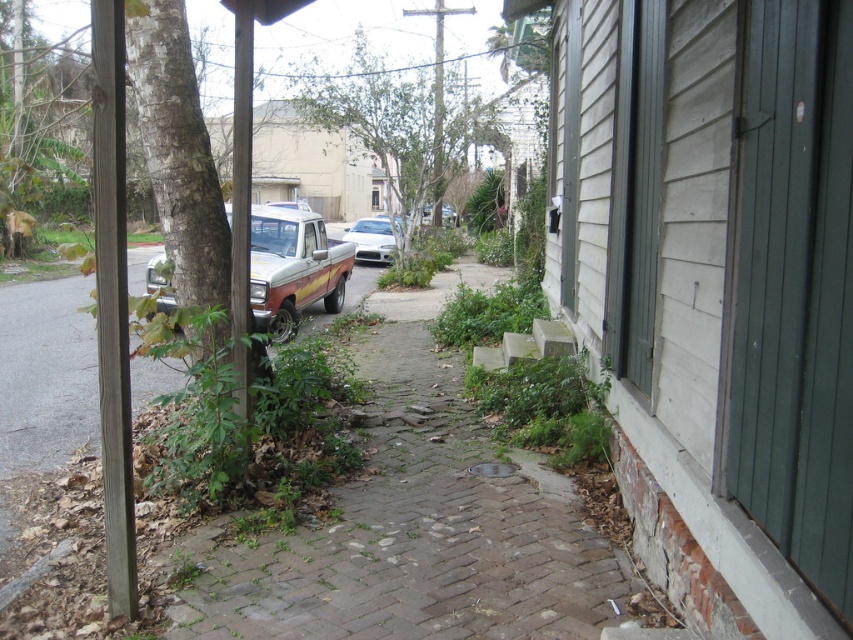
Does green leafy tree at center have a smaller size compared to white glossy sedan at center?

Actually, green leafy tree at center might be larger than white glossy sedan at center.

Is the position of green leafy tree at center more distant than that of white glossy sedan at center?

No, green leafy tree at center is in front of white glossy sedan at center.

At what (x,y) coordinates should I click in order to perform the action: click on green leafy tree at center. Please return your answer as a coordinate pair (x, y). Looking at the image, I should click on (398, 129).

The height and width of the screenshot is (640, 853). Find the location of `green leafy tree at center`. green leafy tree at center is located at coordinates (398, 129).

Does brick paved path at center appear on the left side of green leafy tree at center?

Indeed, brick paved path at center is positioned on the left side of green leafy tree at center.

Between brick paved path at center and green leafy tree at center, which one has more height?

brick paved path at center is taller.

Locate an element on the screen. The height and width of the screenshot is (640, 853). brick paved path at center is located at coordinates (419, 524).

Who is higher up, brick paved path at center or white glossy sedan at center?

white glossy sedan at center is above.

Does brick paved path at center have a greater width compared to white glossy sedan at center?

Yes, brick paved path at center is wider than white glossy sedan at center.

Is point (340, 612) positioned after point (352, 232)?

No.

Where is `brick paved path at center`? This screenshot has height=640, width=853. brick paved path at center is located at coordinates (419, 524).